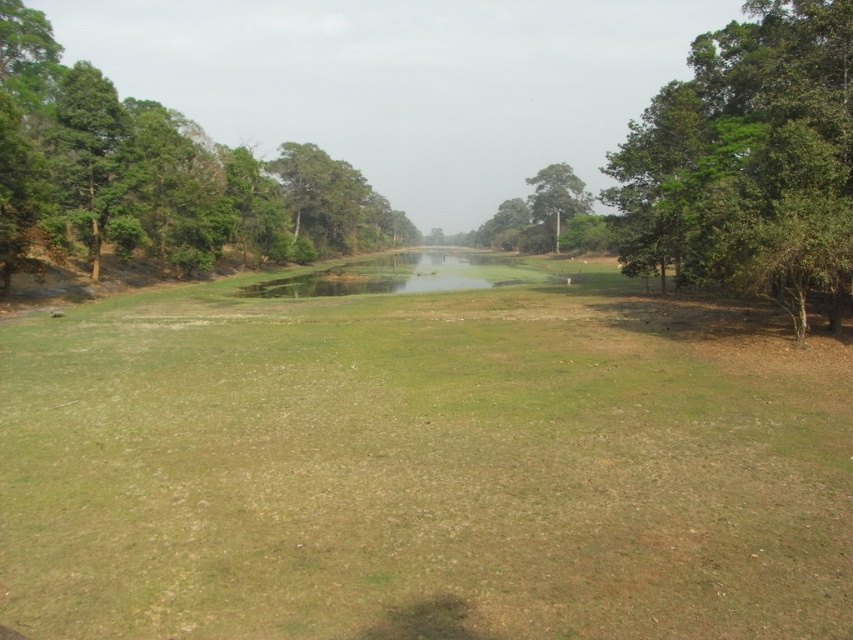
How much distance is there between green leafy tree at left and green leafy tree at right?

green leafy tree at left is 327.73 feet away from green leafy tree at right.

The width and height of the screenshot is (853, 640). Find the location of `green leafy tree at left`. green leafy tree at left is located at coordinates (155, 177).

Can you confirm if green grassy field at center is positioned below green leafy tree at left?

Yes, green grassy field at center is below green leafy tree at left.

Can you confirm if green grassy field at center is thinner than green leafy tree at left?

No.

This screenshot has width=853, height=640. What do you see at coordinates (422, 464) in the screenshot?
I see `green grassy field at center` at bounding box center [422, 464].

This screenshot has height=640, width=853. In order to click on green grassy field at center in this screenshot , I will do `click(422, 464)`.

Which is behind, point (49, 374) or point (715, 182)?

The point (715, 182) is behind.

Does green grassy field at center appear on the left side of green leafy tree at right?

Indeed, green grassy field at center is positioned on the left side of green leafy tree at right.

Which is in front, point (274, 486) or point (688, 170)?

Point (274, 486)

Identify the location of green grassy field at center. (422, 464).